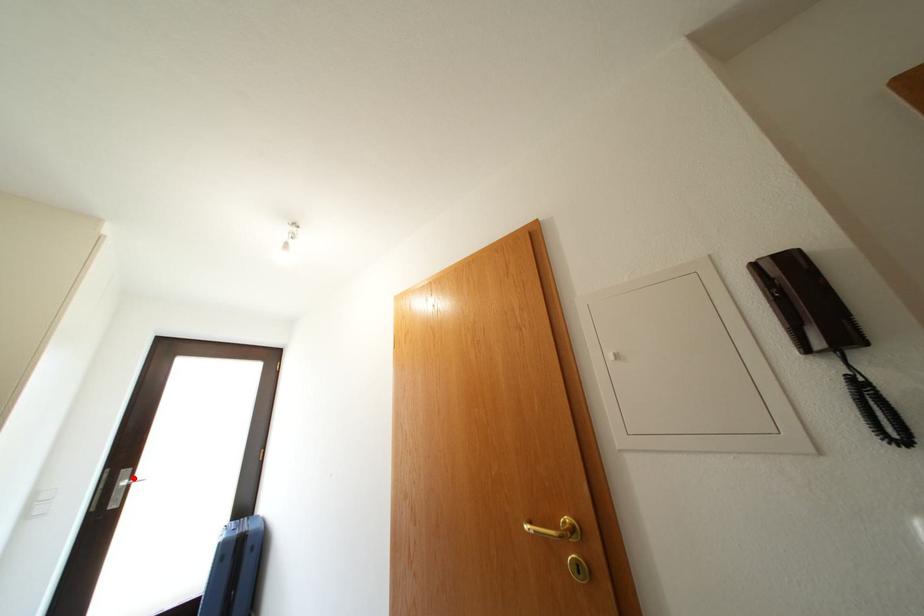
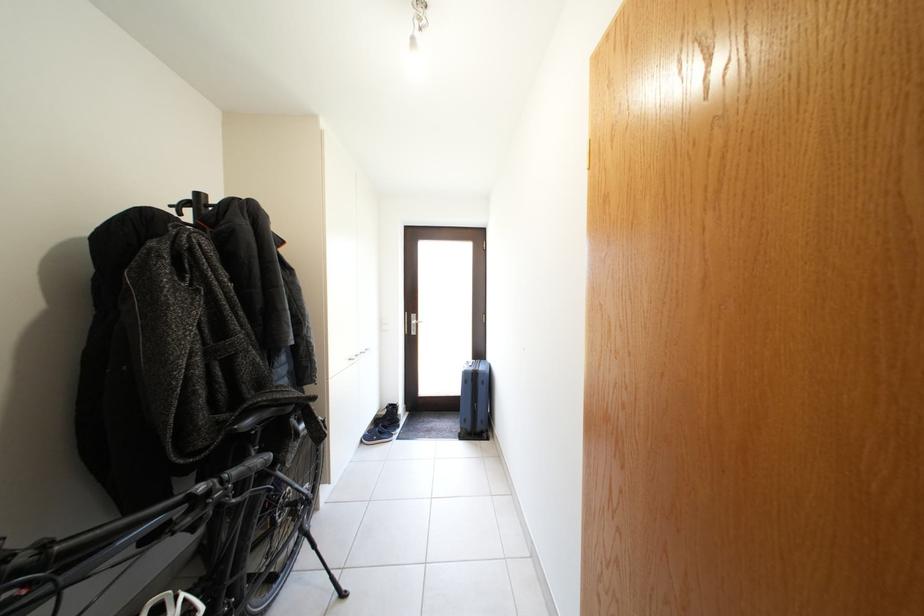
In the second image, find the point that corresponds to the highlighted location in the first image.

(421, 322)